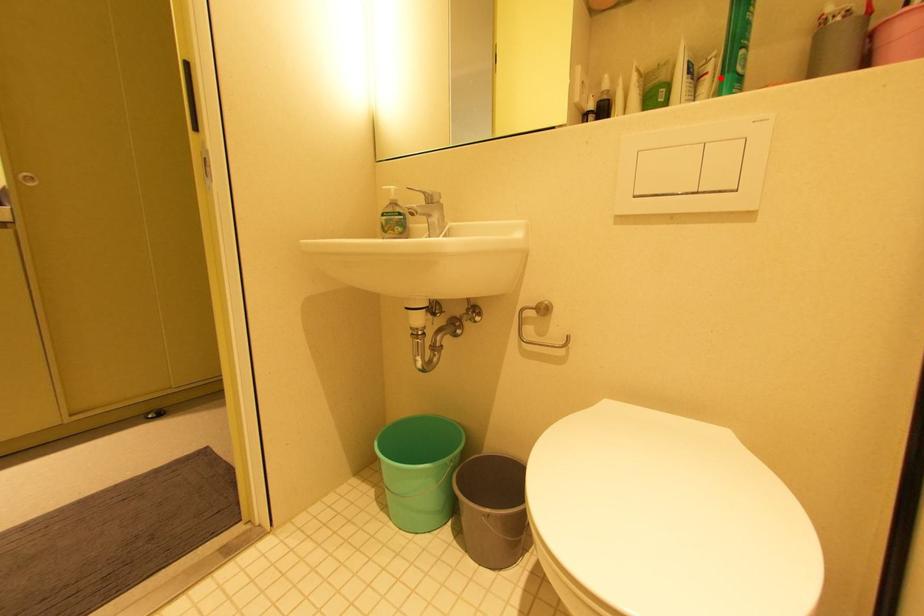
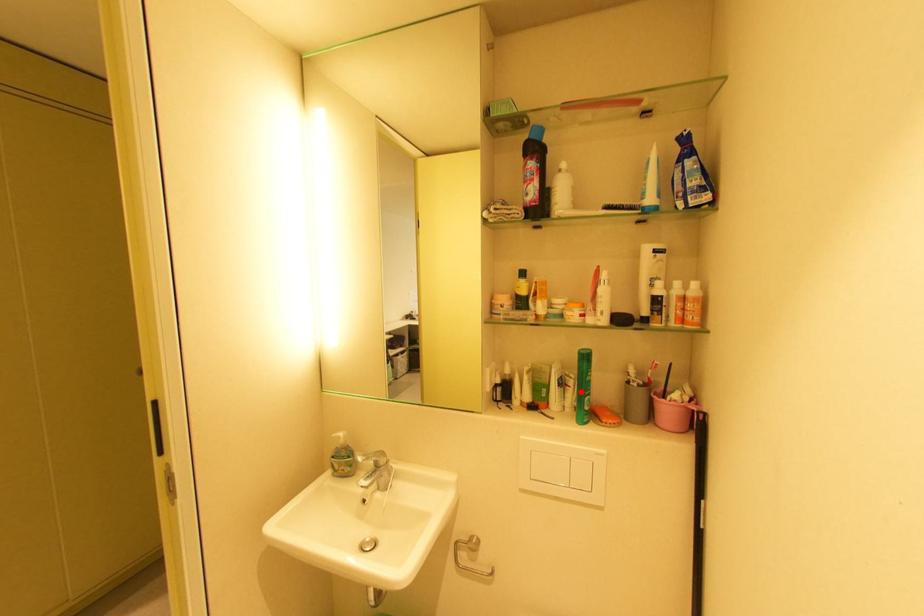
I am providing you with two images of the same scene from different viewpoints. A red point is marked on the first image and another point is marked on the second image. Is the red point in image1 aligned with the point shown in image2?

Yes